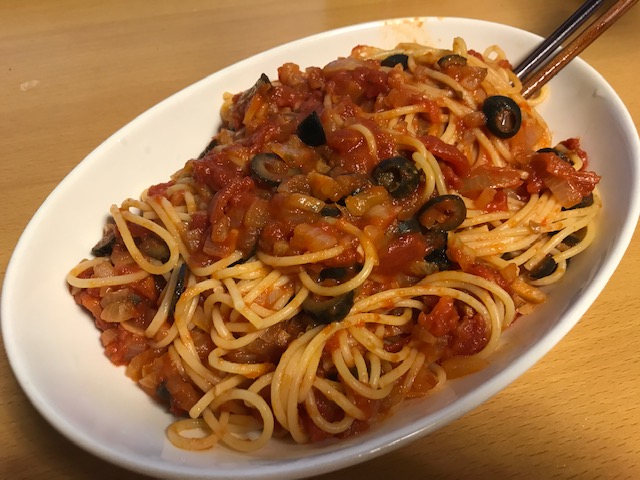
Image resolution: width=640 pixels, height=480 pixels. I want to click on wood surface, so click(x=80, y=61).